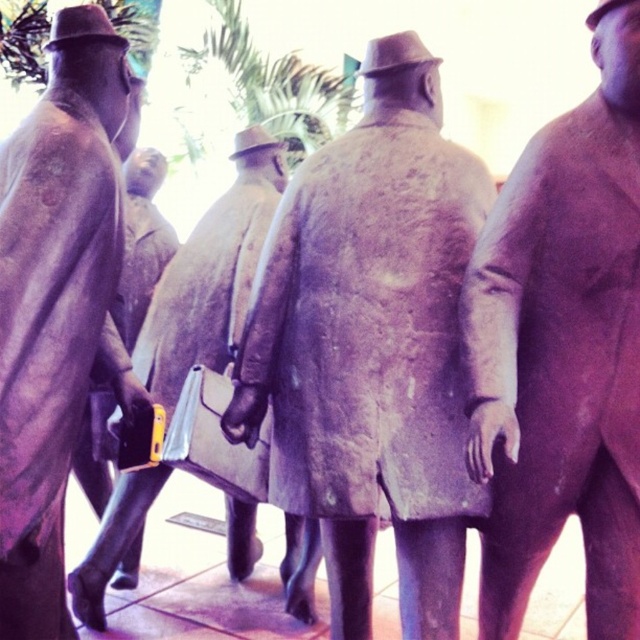
Question: Can you confirm if matte brown coat at center is wider than matte bronze statue at center?

Choices:
 (A) yes
 (B) no

Answer: (A)

Question: Which point is closer to the camera taking this photo?

Choices:
 (A) (228, 522)
 (B) (572, 336)

Answer: (B)

Question: Which point is farther to the camera?

Choices:
 (A) matte gray coat at center
 (B) matte brown coat at center
 (C) matte brown briefcase at center

Answer: (C)

Question: Observing the image, what is the correct spatial positioning of matte gray coat at center in reference to matte brown briefcase at center?

Choices:
 (A) right
 (B) left

Answer: (A)

Question: Does matte bronze statue at center have a lesser width compared to matte brown briefcase at center?

Choices:
 (A) no
 (B) yes

Answer: (B)

Question: Estimate the real-world distances between objects in this image. Which object is closer to the matte brown briefcase at center?

Choices:
 (A) matte gray coat at center
 (B) matte brown coat at center

Answer: (A)